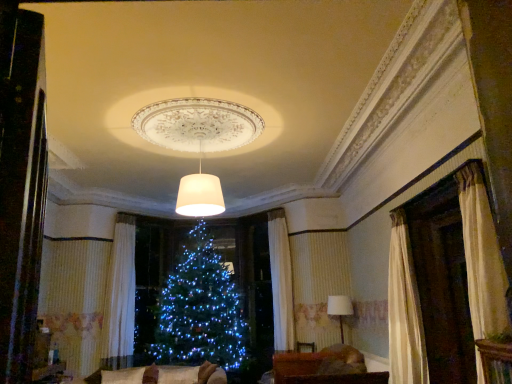
At what (x,y) coordinates should I click in order to perform the action: click on white matte lampshade at center, which is the second lamp from back to front. Please return your answer as a coordinate pair (x, y). The height and width of the screenshot is (384, 512). Looking at the image, I should click on (200, 194).

Locate an element on the screen. white fabric lampshade at right, the second lamp viewed from the front is located at coordinates (340, 309).

What do you see at coordinates (340, 309) in the screenshot? I see `white fabric lampshade at right, the first lamp from the bottom` at bounding box center [340, 309].

Where is `white textured curtain at left`? The image size is (512, 384). white textured curtain at left is located at coordinates (121, 296).

Which of these two, white matte lampshade at center, which is the 2th lamp from right to left, or velvet beige couch at lower center, is smaller?

With smaller size is white matte lampshade at center, which is the 2th lamp from right to left.

Looking at this image, is white matte lampshade at center, which is the 2th lamp from right to left, thinner than velvet beige couch at lower center?

Yes.

In the scene shown: Is white matte lampshade at center, which is the second lamp from back to front, oriented towards velvet beige couch at lower center?

No, white matte lampshade at center, which is the second lamp from back to front, is not turned towards velvet beige couch at lower center.

From a real-world perspective, who is located lower, white matte lampshade at center, positioned as the 1th lamp in front-to-back order, or velvet beige couch at lower center?

In real-world perspective, velvet beige couch at lower center is lower.

Does point (347, 378) come farther from viewer compared to point (207, 206)?

That is True.

Does brown fabric couch at lower center have a greater width compared to white matte lampshade at center, which is counted as the 2th lamp, starting from the bottom?

Yes, brown fabric couch at lower center is wider than white matte lampshade at center, which is counted as the 2th lamp, starting from the bottom.

Is brown fabric couch at lower center not near white matte lampshade at center, which is the 2th lamp from right to left?

brown fabric couch at lower center is far away from white matte lampshade at center, which is the 2th lamp from right to left.

From a real-world perspective, does white fabric lampshade at right, the first lamp from the bottom, sit lower than white matte lampshade at center, which is the second lamp from back to front?

Yes, from a real-world perspective, white fabric lampshade at right, the first lamp from the bottom, is below white matte lampshade at center, which is the second lamp from back to front.

This screenshot has height=384, width=512. I want to click on lamp in front of the white fabric lampshade at right, which is the 1th lamp in back-to-front order, so click(x=200, y=194).

Considering the points (334, 314) and (185, 200), which point is behind, point (334, 314) or point (185, 200)?

The point (334, 314) is behind.

Does point (127, 297) come in front of point (346, 311)?

No.

Considering their positions, is white textured curtain at left located in front of or behind white fabric lampshade at right, the 1th lamp viewed from the right?

Clearly, white textured curtain at left is behind white fabric lampshade at right, the 1th lamp viewed from the right.

Can you confirm if white textured curtain at left is positioned to the right of white fabric lampshade at right, the first lamp from the bottom?

No, white textured curtain at left is not to the right of white fabric lampshade at right, the first lamp from the bottom.

Is white textured curtain at left facing away from white fabric lampshade at right, the second lamp viewed from the front?

white textured curtain at left is not turned away from white fabric lampshade at right, the second lamp viewed from the front.

In the scene shown: From the image's perspective, is brown fabric couch at lower center over white textured curtain at left?

No, from the image's perspective, brown fabric couch at lower center is not above white textured curtain at left.

Who is taller, brown fabric couch at lower center or white textured curtain at left?

white textured curtain at left.

Is brown fabric couch at lower center wider or thinner than white textured curtain at left?

brown fabric couch at lower center is wider than white textured curtain at left.

From a real-world perspective, which object rests below the other?

From a 3D spatial view, brown fabric couch at lower center is below.

Would you say brown fabric couch at lower center is inside or outside velvet beige couch at lower center?

brown fabric couch at lower center is not inside velvet beige couch at lower center, it's outside.

Is point (343, 351) farther from viewer compared to point (133, 382)?

Yes, it is behind point (133, 382).

Is brown fabric couch at lower center aimed at velvet beige couch at lower center?

Yes, brown fabric couch at lower center faces towards velvet beige couch at lower center.

Is white fabric lampshade at right, positioned as the 2th lamp in top-to-bottom order, located outside white textured curtain at left?

Indeed, white fabric lampshade at right, positioned as the 2th lamp in top-to-bottom order, is completely outside white textured curtain at left.

From a real-world perspective, which object rests below the other?

In real-world perspective, white fabric lampshade at right, the first lamp from the bottom, is lower.

Consider the image. Which object is positioned more to the left, white fabric lampshade at right, the 1th lamp viewed from the right, or white textured curtain at left?

Positioned to the left is white textured curtain at left.

The height and width of the screenshot is (384, 512). What are the coordinates of `lamp that appears in front of the velvet beige couch at lower center` in the screenshot? It's located at (200, 194).

In the image, there is a white matte lampshade at center, which is the first lamp from top to bottom. Where is `furniture below it (from a real-world perspective)`? The height and width of the screenshot is (384, 512). furniture below it (from a real-world perspective) is located at coordinates (318, 365).

When comparing their distances from white textured curtain at left, does velvet beige couch at lower center or white matte lampshade at center, which is the second lamp from back to front, seem further?

white matte lampshade at center, which is the second lamp from back to front, is further to white textured curtain at left.

Based on their spatial positions, is brown fabric couch at lower center or velvet beige couch at lower center further from white matte lampshade at center, which ranks as the first lamp in left-to-right order?

Based on the image, velvet beige couch at lower center appears to be further to white matte lampshade at center, which ranks as the first lamp in left-to-right order.

Based on their spatial positions, is white textured curtain at left or velvet beige couch at lower center further from white matte lampshade at center, which is the second lamp from back to front?

Based on the image, velvet beige couch at lower center appears to be further to white matte lampshade at center, which is the second lamp from back to front.

From the picture: Considering their positions, is brown fabric couch at lower center positioned further to white textured curtain at left than white fabric lampshade at right, which is the 1th lamp in back-to-front order?

The object further to white textured curtain at left is white fabric lampshade at right, which is the 1th lamp in back-to-front order.

Estimate the real-world distances between objects in this image. Which object is closer to white fabric lampshade at right, which is the 1th lamp in back-to-front order, white matte lampshade at center, which is the second lamp from back to front, or velvet beige couch at lower center?

velvet beige couch at lower center.

Estimate the real-world distances between objects in this image. Which object is further from velvet beige couch at lower center, brown fabric couch at lower center or white matte lampshade at center, which is the first lamp from top to bottom?

white matte lampshade at center, which is the first lamp from top to bottom, is positioned further to the anchor velvet beige couch at lower center.

Considering their positions, is white matte lampshade at center, positioned as the 1th lamp in front-to-back order, positioned further to velvet beige couch at lower center than white fabric lampshade at right, the second lamp viewed from the front?

white fabric lampshade at right, the second lamp viewed from the front.

Based on their spatial positions, is white textured curtain at left or white matte lampshade at center, which ranks as the first lamp in left-to-right order, further from brown fabric couch at lower center?

The object further to brown fabric couch at lower center is white textured curtain at left.

Where is `couch between white textured curtain at left and brown fabric couch at lower center from left to right`? This screenshot has height=384, width=512. couch between white textured curtain at left and brown fabric couch at lower center from left to right is located at coordinates (135, 375).

The width and height of the screenshot is (512, 384). Find the location of `lamp situated between white textured curtain at left and brown fabric couch at lower center from left to right`. lamp situated between white textured curtain at left and brown fabric couch at lower center from left to right is located at coordinates click(200, 194).

Where is `lamp between white textured curtain at left and white fabric lampshade at right, the second lamp viewed from the front`? The image size is (512, 384). lamp between white textured curtain at left and white fabric lampshade at right, the second lamp viewed from the front is located at coordinates (200, 194).

The height and width of the screenshot is (384, 512). What are the coordinates of `couch between white matte lampshade at center, which ranks as the first lamp in left-to-right order, and brown fabric couch at lower center, in the vertical direction` in the screenshot? It's located at (135, 375).